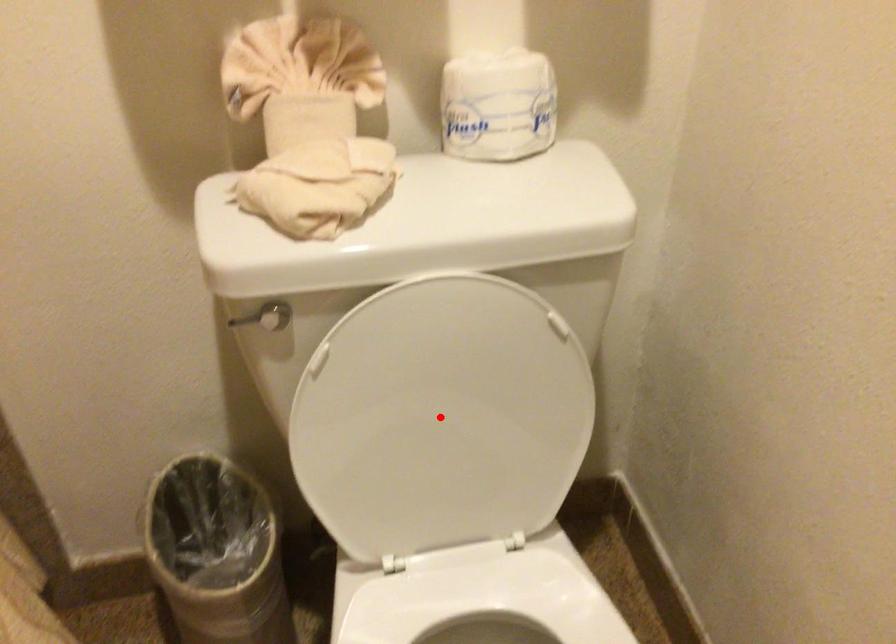
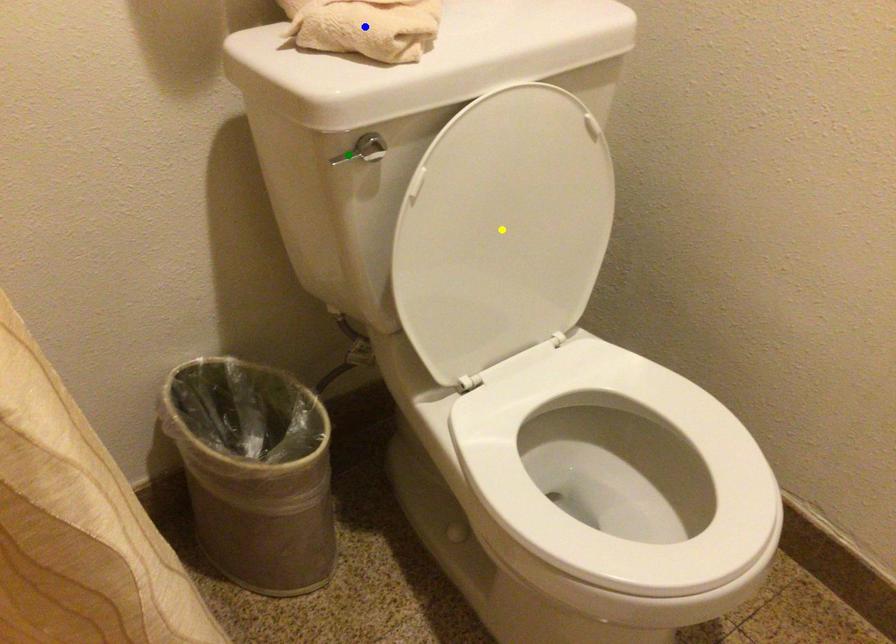
Question: I am providing you with two images of the same scene from different viewpoints. A red point is marked on the first image. You are given multiple points on the second image. Which point in image 2 represents the same 3d spot as the red point in image 1?

Choices:
 (A) yellow point
 (B) blue point
 (C) green point

Answer: (A)